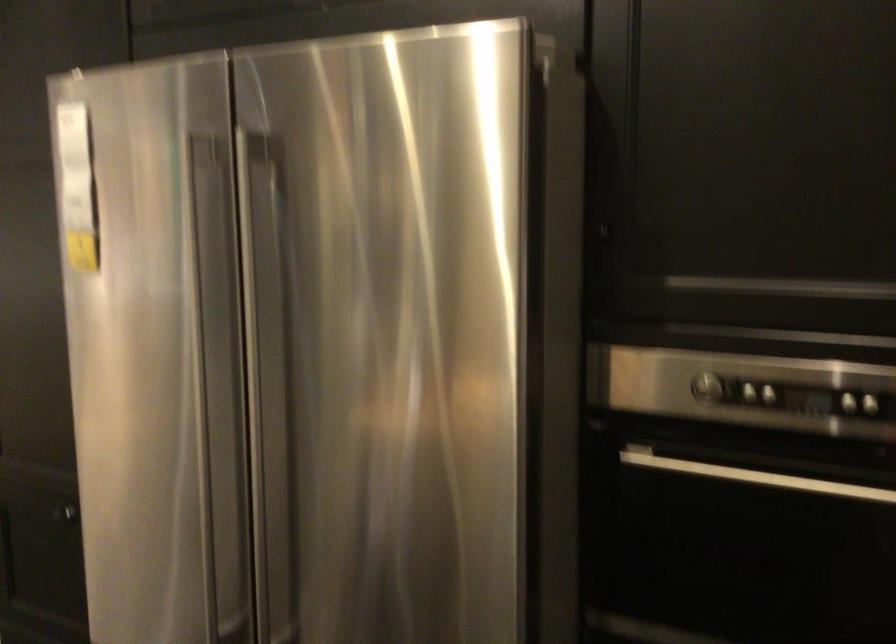
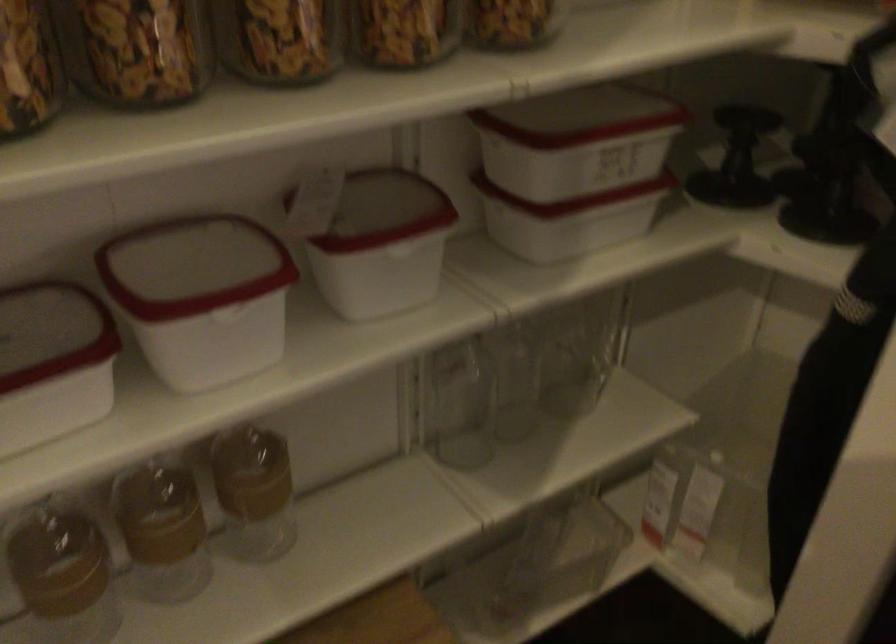
The images are taken continuously from a first-person perspective. In which direction is your viewpoint rotating?

The rotation direction of the camera is right-down.